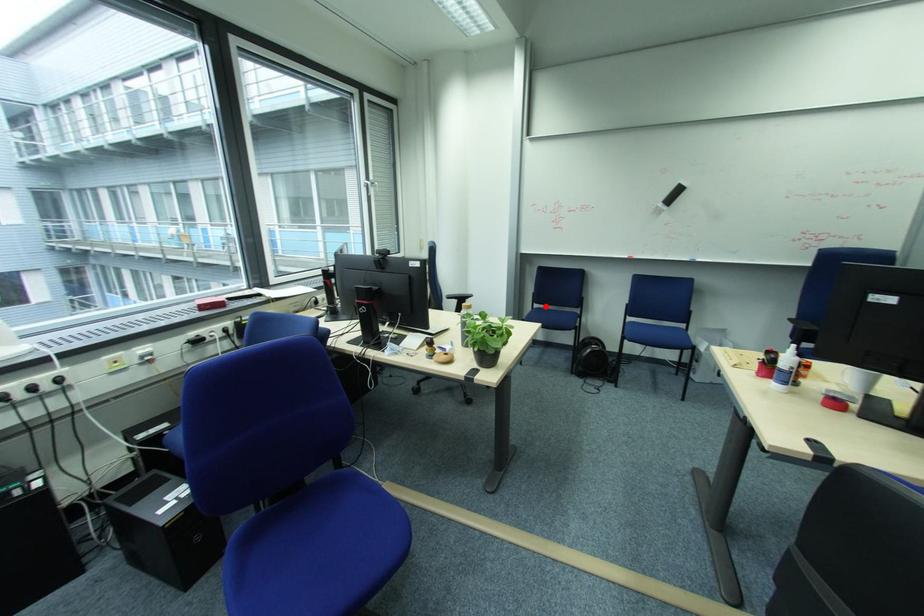
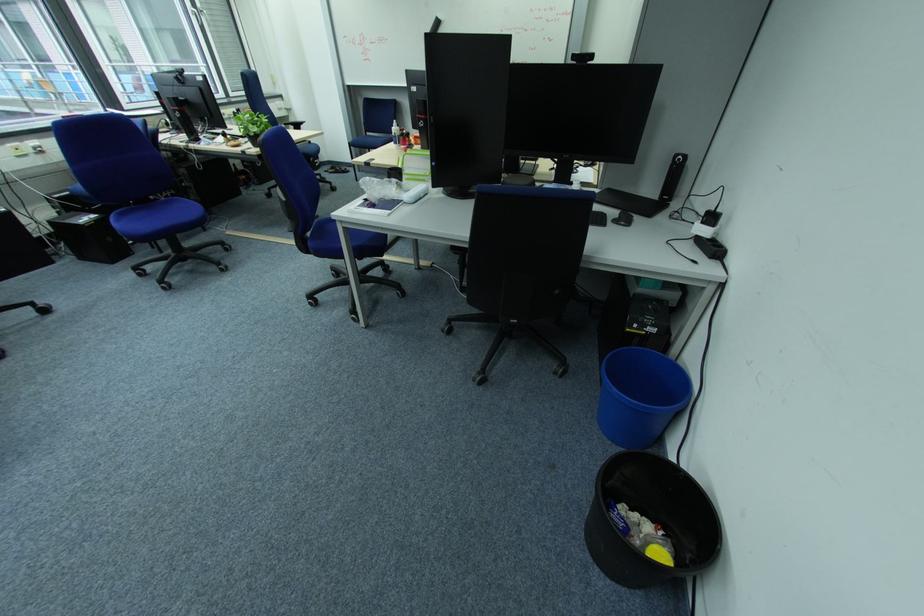
The point at the highlighted location is marked in the first image. Where is the corresponding point in the second image?

(378, 135)